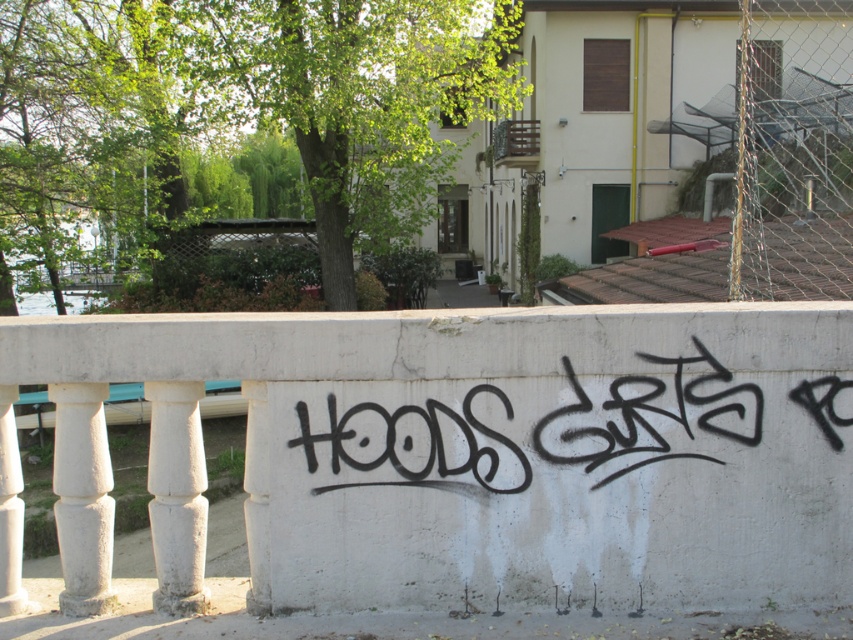
In the scene shown: Which is above, white concrete fence at center or black graffiti at center?

black graffiti at center

Can you confirm if white concrete fence at center is wider than black graffiti at center?

Correct, the width of white concrete fence at center exceeds that of black graffiti at center.

The width and height of the screenshot is (853, 640). I want to click on white concrete fence at center, so click(x=474, y=452).

Locate an element on the screen. The image size is (853, 640). white concrete fence at center is located at coordinates (474, 452).